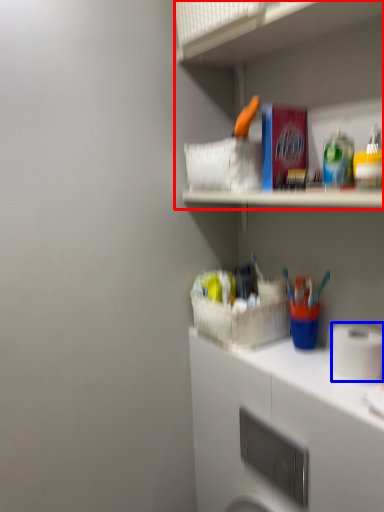
Question: Which object appears farthest to the camera in this image, shelf (highlighted by a red box) or toilet paper (highlighted by a blue box)?

Choices:
 (A) shelf
 (B) toilet paper

Answer: (B)